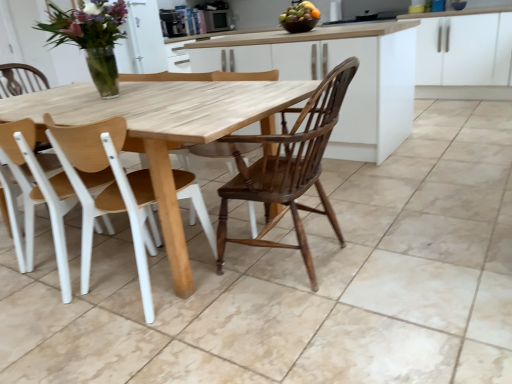
Describe the element at coordinates (91, 37) in the screenshot. The width and height of the screenshot is (512, 384). I see `clear glass vase at upper left` at that location.

You are a GUI agent. You are given a task and a screenshot of the screen. Output one action in this format:
    pyautogui.click(x=<x>, y=<y>)
    Task: Click on the natural wood table at center
    
    Given the screenshot: What is the action you would take?
    pyautogui.click(x=166, y=129)

Locate an element on the screen. glossy ceramic bowl at upper center is located at coordinates (298, 12).

Is white plastic chair at left, acting as the second chair starting from the right, positioned far away from glossy ceramic bowl at upper center?

white plastic chair at left, acting as the second chair starting from the right, is positioned a significant distance from glossy ceramic bowl at upper center.

From the image's perspective, is white plastic chair at left, which is the first chair in left-to-right order, positioned above or below glossy ceramic bowl at upper center?

white plastic chair at left, which is the first chair in left-to-right order, is situated lower than glossy ceramic bowl at upper center in the image.

From a real-world perspective, is white plastic chair at left, acting as the second chair starting from the right, above or below glossy ceramic bowl at upper center?

Clearly, from a real-world perspective, white plastic chair at left, acting as the second chair starting from the right, is below glossy ceramic bowl at upper center.

Does point (56, 185) come in front of point (295, 14)?

Yes, it is.

This screenshot has width=512, height=384. Find the location of `chair that is on the left side of natural wood table at center`. chair that is on the left side of natural wood table at center is located at coordinates (40, 195).

Between white plastic chair at left, which is the first chair in left-to-right order, and natural wood table at center, which one has larger width?

With larger width is natural wood table at center.

Looking at this image, choose the correct answer: Is white plastic chair at left, acting as the second chair starting from the right, inside natural wood table at center or outside it?

white plastic chair at left, acting as the second chair starting from the right, is inside natural wood table at center.

Looking at this image, between matte black microwave at upper center and natural wood table at center, which one is positioned in front?

natural wood table at center is in front.

Is matte black microwave at upper center situated inside natural wood table at center or outside?

matte black microwave at upper center is not inside natural wood table at center, it's outside.

In terms of size, does matte black microwave at upper center appear bigger or smaller than natural wood table at center?

Clearly, matte black microwave at upper center is smaller in size than natural wood table at center.

From a real-world perspective, who is located higher, matte black microwave at upper center or natural wood table at center?

In real-world perspective, matte black microwave at upper center is above.

Based on the photo, is clear glass vase at upper left closer to camera compared to natural wood table at center?

No, it is not.

How many degrees apart are the facing directions of clear glass vase at upper left and natural wood table at center?

0.556 degrees separate the facing orientations of clear glass vase at upper left and natural wood table at center.

Is clear glass vase at upper left bigger or smaller than natural wood table at center?

Clearly, clear glass vase at upper left is smaller in size than natural wood table at center.

Consider the image. Does clear glass vase at upper left appear on the left side of natural wood table at center?

Yes, clear glass vase at upper left is to the left of natural wood table at center.

From a real-world perspective, is glossy ceramic bowl at upper center located higher than clear glass vase at upper left?

Yes, from a real-world perspective, glossy ceramic bowl at upper center is on top of clear glass vase at upper left.

Between glossy ceramic bowl at upper center and clear glass vase at upper left, which one appears on the left side from the viewer's perspective?

From the viewer's perspective, clear glass vase at upper left appears more on the left side.

Are glossy ceramic bowl at upper center and clear glass vase at upper left making contact?

They are not placed beside each other.

Measure the distance between glossy ceramic bowl at upper center and clear glass vase at upper left.

glossy ceramic bowl at upper center is 1.65 meters from clear glass vase at upper left.

In the scene shown: Which point is more forward, (116, 127) or (496, 43)?

The point (116, 127) is in front.

Is wooden at center, the 2th chair viewed from the left, positioned far away from white matte cabinet at upper right?

Yes, wooden at center, the 2th chair viewed from the left, is far from white matte cabinet at upper right.

Considering the relative sizes of wooden at center, the 2th chair viewed from the left, and white matte cabinet at upper right in the image provided, is wooden at center, the 2th chair viewed from the left, shorter than white matte cabinet at upper right?

Correct, wooden at center, the 2th chair viewed from the left, is not as tall as white matte cabinet at upper right.

Based on the photo, are matte black microwave at upper center and glossy ceramic bowl at upper center making contact?

No, matte black microwave at upper center is not making contact with glossy ceramic bowl at upper center.

Is matte black microwave at upper center oriented towards glossy ceramic bowl at upper center?

No, matte black microwave at upper center is not oriented towards glossy ceramic bowl at upper center.

In order to click on fruit above the matte black microwave at upper center (from a real-world perspective) in this screenshot , I will do `click(298, 12)`.

The width and height of the screenshot is (512, 384). Identify the location of the 2nd chair to the left of the glossy ceramic bowl at upper center, counting from the anchor's position. (40, 195).

Where is `table in front of the white plastic chair at left, which is the first chair in left-to-right order`? This screenshot has width=512, height=384. table in front of the white plastic chair at left, which is the first chair in left-to-right order is located at coordinates (166, 129).

When comparing their distances from clear glass vase at upper left, does wooden at center, the 1th chair when ordered from right to left, or matte black microwave at upper center seem closer?

wooden at center, the 1th chair when ordered from right to left, is closer to clear glass vase at upper left.

Consider the image. Considering their positions, is wooden at center, the 2th chair viewed from the left, positioned closer to natural wood table at center than white plastic chair at left, which is the first chair in left-to-right order?

wooden at center, the 2th chair viewed from the left, lies closer to natural wood table at center than the other object.

From the picture: Based on their spatial positions, is white plastic chair at left, acting as the second chair starting from the right, or white matte cabinet at upper right closer to glossy ceramic bowl at upper center?

white matte cabinet at upper right lies closer to glossy ceramic bowl at upper center than the other object.

Considering their positions, is natural wood table at center positioned closer to matte black microwave at upper center than wooden at center, the 1th chair when ordered from right to left?

The object closer to matte black microwave at upper center is natural wood table at center.

When comparing their distances from matte black microwave at upper center, does white plastic chair at left, acting as the second chair starting from the right, or clear glass vase at upper left seem closer?

clear glass vase at upper left is closer to matte black microwave at upper center.

Looking at the image, which one is located further to glossy ceramic bowl at upper center, clear glass vase at upper left or white matte cabinet at upper right?

white matte cabinet at upper right is positioned further to the anchor glossy ceramic bowl at upper center.

Considering their positions, is white plastic chair at left, acting as the second chair starting from the right, positioned further to matte black microwave at upper center than natural wood table at center?

white plastic chair at left, acting as the second chair starting from the right.

From the image, which object appears to be farther from glossy ceramic bowl at upper center, natural wood table at center or wooden at center, the 2th chair viewed from the left?

wooden at center, the 2th chair viewed from the left.

Where is `fruit positioned between wooden at center, the 2th chair viewed from the left, and matte black microwave at upper center from near to far`? This screenshot has height=384, width=512. fruit positioned between wooden at center, the 2th chair viewed from the left, and matte black microwave at upper center from near to far is located at coordinates (298, 12).

You are a GUI agent. You are given a task and a screenshot of the screen. Output one action in this format:
    pyautogui.click(x=<x>, y=<y>)
    Task: Click on the fruit between wooden at center, the 1th chair when ordered from right to left, and white matte cabinet at upper right
    
    Given the screenshot: What is the action you would take?
    pyautogui.click(x=298, y=12)

This screenshot has width=512, height=384. I want to click on cabinetry located between glossy ceramic bowl at upper center and matte black microwave at upper center in the depth direction, so click(x=464, y=49).

Locate an element on the screen. The height and width of the screenshot is (384, 512). table between clear glass vase at upper left and white matte cabinet at upper right is located at coordinates pos(166,129).